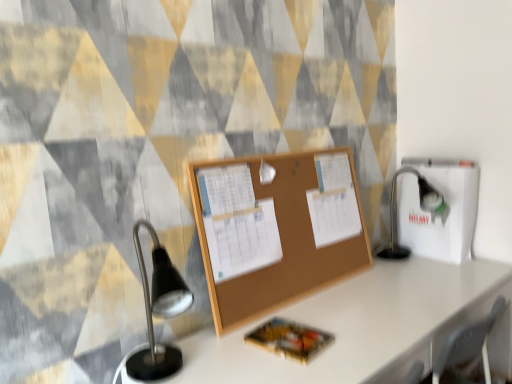
What do you see at coordinates (284, 235) in the screenshot?
I see `corkboard at center` at bounding box center [284, 235].

Where is `black metal table lamp at right`? This screenshot has height=384, width=512. black metal table lamp at right is located at coordinates (420, 207).

This screenshot has width=512, height=384. Find the location of `cardboard box that appears on the right of black metal table lamp at right`. cardboard box that appears on the right of black metal table lamp at right is located at coordinates (437, 212).

Does point (476, 176) appear closer or farther from the camera than point (405, 248)?

Point (476, 176) is closer to the camera than point (405, 248).

Is white cardboard box at right positioned far away from black metal table lamp at right?

No, white cardboard box at right is not far from black metal table lamp at right.

From the image's perspective, which object appears higher, white cardboard box at right or black metal table lamp at right?

white cardboard box at right appears higher in the image.

Between white cardboard box at right and corkboard at center, which one has smaller size?

corkboard at center is smaller.

Which is more to the left, white cardboard box at right or corkboard at center?

Positioned to the left is corkboard at center.

Is white cardboard box at right looking in the opposite direction of corkboard at center?

white cardboard box at right is not turned away from corkboard at center.

Is white cardboard box at right shorter than corkboard at center?

Indeed, white cardboard box at right has a lesser height compared to corkboard at center.

From the picture: Which object is more forward, black metal table lamp at right or corkboard at center?

corkboard at center is more forward.

Which object is positioned more to the right, black metal table lamp at right or corkboard at center?

black metal table lamp at right is more to the right.

Could you tell me if black metal table lamp at right is facing corkboard at center?

No, black metal table lamp at right is not facing towards corkboard at center.

Considering the sizes of objects black metal table lamp at right and corkboard at center in the image provided, who is taller, black metal table lamp at right or corkboard at center?

corkboard at center is taller.

Considering the sizes of objects corkboard at center and black metal table lamp at right in the image provided, who is taller, corkboard at center or black metal table lamp at right?

Standing taller between the two is corkboard at center.

Where is `bulletin board above the black metal table lamp at right (from a real-world perspective)`? This screenshot has width=512, height=384. bulletin board above the black metal table lamp at right (from a real-world perspective) is located at coordinates (284, 235).

Which object is wider, corkboard at center or black metal table lamp at right?

black metal table lamp at right.

From the image's perspective, which object appears higher, corkboard at center or black metal table lamp at right?

corkboard at center is shown above in the image.

Considering the sizes of black metal table lamp at right and white cardboard box at right in the image, is black metal table lamp at right taller or shorter than white cardboard box at right?

black metal table lamp at right is shorter than white cardboard box at right.

From a real-world perspective, between black metal table lamp at right and white cardboard box at right, who is vertically higher?

white cardboard box at right.

Looking at their sizes, would you say black metal table lamp at right is wider or thinner than white cardboard box at right?

Clearly, black metal table lamp at right has more width compared to white cardboard box at right.

Would you say corkboard at center is to the left or to the right of white cardboard box at right in the picture?

Based on their positions, corkboard at center is located to the left of white cardboard box at right.

Is corkboard at center surrounding white cardboard box at right?

No, corkboard at center does not contain white cardboard box at right.

From a real-world perspective, which object stands above the other?

corkboard at center.

Locate an element on the screen. The width and height of the screenshot is (512, 384). table lamp in front of the white cardboard box at right is located at coordinates (420, 207).

At what (x,y) coordinates should I click in order to perform the action: click on cardboard box behind the corkboard at center. Please return your answer as a coordinate pair (x, y). This screenshot has height=384, width=512. Looking at the image, I should click on (437, 212).

Estimate the real-world distances between objects in this image. Which object is further from white cardboard box at right, black metal table lamp at right or corkboard at center?

corkboard at center lies further to white cardboard box at right than the other object.

Estimate the real-world distances between objects in this image. Which object is further from black metal table lamp at right, white cardboard box at right or corkboard at center?

Based on the image, corkboard at center appears to be further to black metal table lamp at right.

From the image, which object appears to be farther from corkboard at center, black metal table lamp at right or white cardboard box at right?

Based on the image, black metal table lamp at right appears to be further to corkboard at center.

Considering their positions, is white cardboard box at right positioned further to corkboard at center than black metal table lamp at right?

black metal table lamp at right is further to corkboard at center.

Looking at the image, which one is located closer to white cardboard box at right, corkboard at center or black metal table lamp at right?

black metal table lamp at right.

Considering their positions, is corkboard at center positioned further to black metal table lamp at right than white cardboard box at right?

corkboard at center.

Locate an element on the screen. table lamp between corkboard at center and white cardboard box at right from left to right is located at coordinates (420, 207).